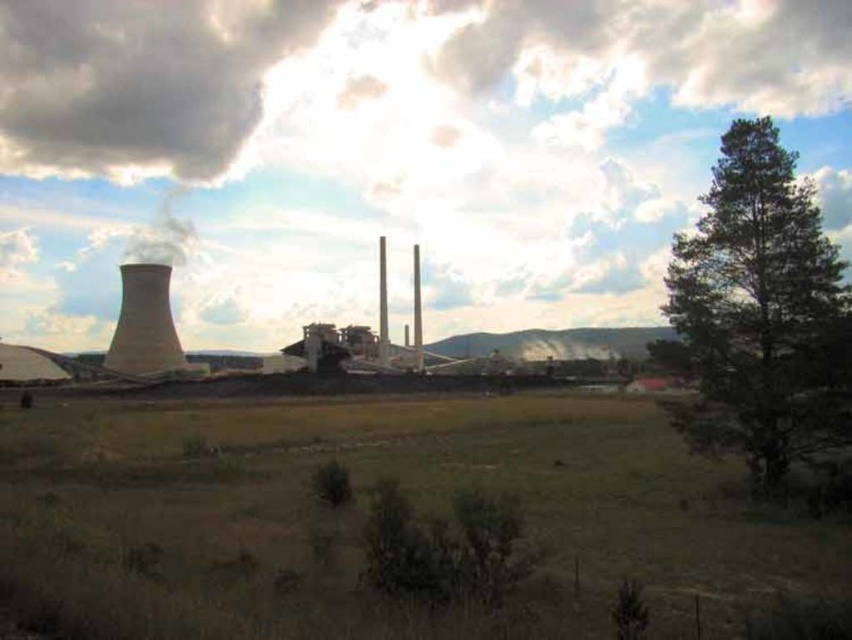
You are a photographer planning to capture the green leafy tree at right and the dark gray cloud at upper left in a single frame. Based on their positions, will the tree appear to be in front of or behind the cloud in the photo?

The green leafy tree at right is positioned under dark gray cloud at upper left, so in the photo, the tree will appear to be in front of the cloud.

You are a photographer planning to capture the industrial facility while including both the green leafy tree at right and the dark gray cloud at upper left in your shot. Based on their sizes, which object should you focus on to ensure both are visible in the frame?

The green leafy tree at right is not as tall as the dark gray cloud at upper left, so you should focus on the dark gray cloud at upper left to ensure both are visible in the frame since it is larger and can help frame the composition.

You are an airplane pilot preparing to land at an airport located behind the industrial facility. You need to avoid the green leafy tree at right and the white fluffy cloud at upper center. Which object should you steer your plane to the right to avoid?

You should steer your plane to the right to avoid the green leafy tree at right because it is on the right side of the white fluffy cloud at upper center.